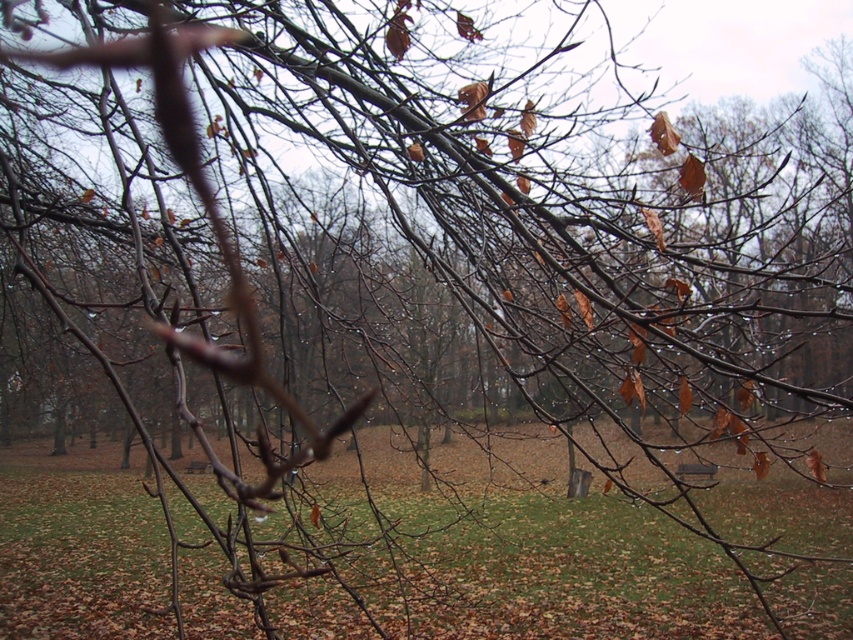
Question: Is green matte grass at center thinner than wooden park bench at center?

Choices:
 (A) yes
 (B) no

Answer: (B)

Question: Does green matte grass at center have a larger size compared to wooden park bench at center?

Choices:
 (A) no
 (B) yes

Answer: (B)

Question: Among these points, which one is nearest to the camera?

Choices:
 (A) (709, 484)
 (B) (811, 524)

Answer: (B)

Question: Is green matte grass at center thinner than wooden park bench at center?

Choices:
 (A) no
 (B) yes

Answer: (A)